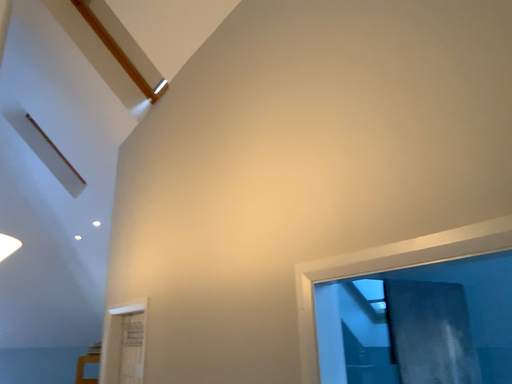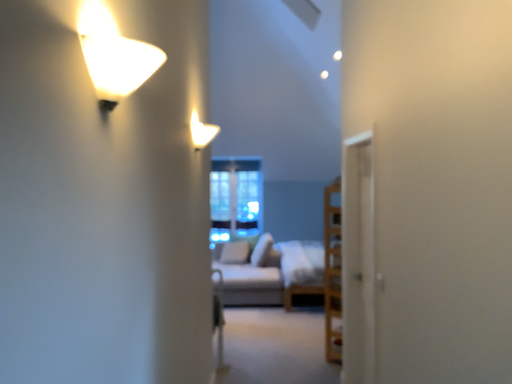
Question: Which way did the camera rotate in the video?

Choices:
 (A) rotated upward
 (B) rotated downward

Answer: (B)